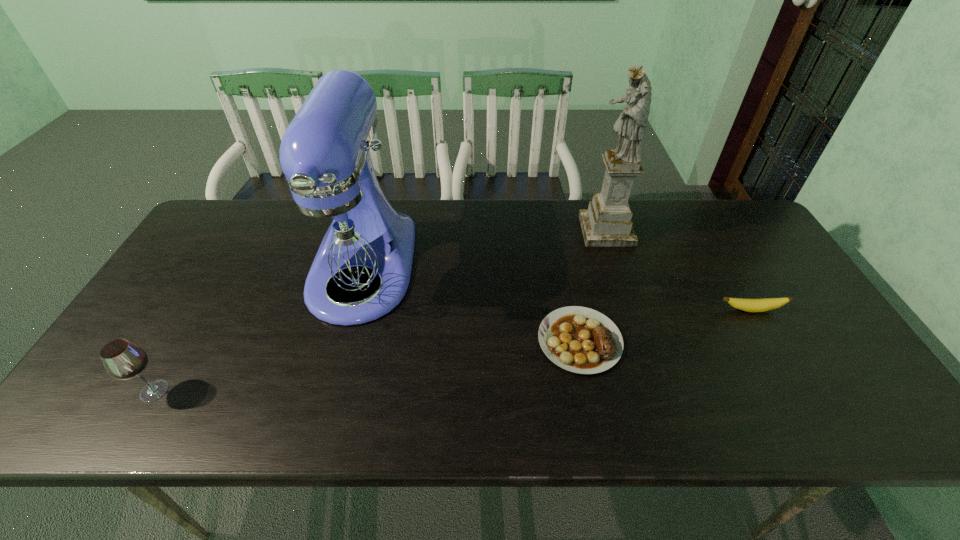
The image size is (960, 540). Find the location of `free region located 0.230m at the mixing area of the mixer`. free region located 0.230m at the mixing area of the mixer is located at coordinates (320, 426).

This screenshot has width=960, height=540. What are the coordinates of `blank space located on the back of the wineglass` in the screenshot? It's located at (225, 272).

Locate an element on the screen. vacant space situated 0.060m on the front of the rightmost object is located at coordinates (764, 333).

Image resolution: width=960 pixels, height=540 pixels. Identify the location of free space located 0.170m on the back of the shortest object. (564, 265).

Image resolution: width=960 pixels, height=540 pixels. Identify the location of sculpture situated at the far edge. (607, 222).

Where is `mixer that is positioned at the far edge`? mixer that is positioned at the far edge is located at coordinates (339, 234).

This screenshot has width=960, height=540. I want to click on object that is at the near edge, so click(122, 359).

This screenshot has height=540, width=960. I want to click on object present at the left edge, so click(x=122, y=359).

At what (x,y) coordinates should I click in order to perform the action: click on object that is at the right edge. Please return your answer as a coordinate pair (x, y). Looking at the image, I should click on (750, 305).

This screenshot has height=540, width=960. In order to click on object at the near left corner in this screenshot , I will do `click(122, 359)`.